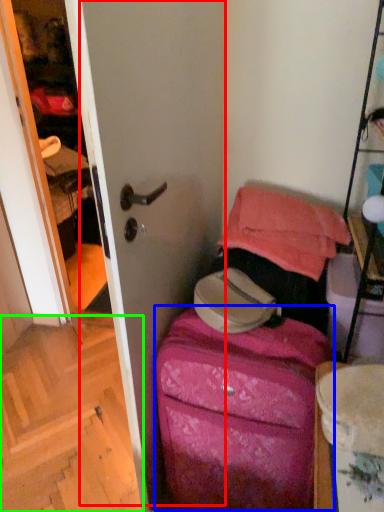
Question: Which object is positioned closest to screen door (highlighted by a red box)? Select from luggage (highlighted by a blue box) and stairwell (highlighted by a green box).

Choices:
 (A) luggage
 (B) stairwell

Answer: (A)